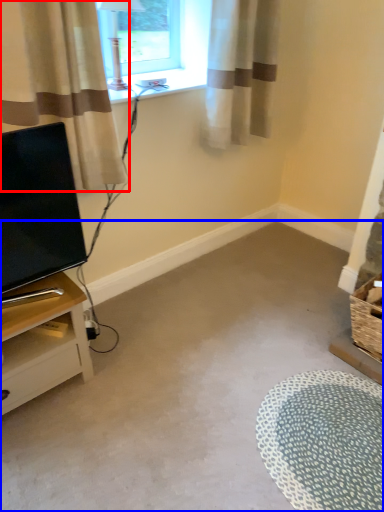
Question: Which of the following is the closest to the observer, curtain (highlighted by a red box) or plain (highlighted by a blue box)?

Choices:
 (A) curtain
 (B) plain

Answer: (B)